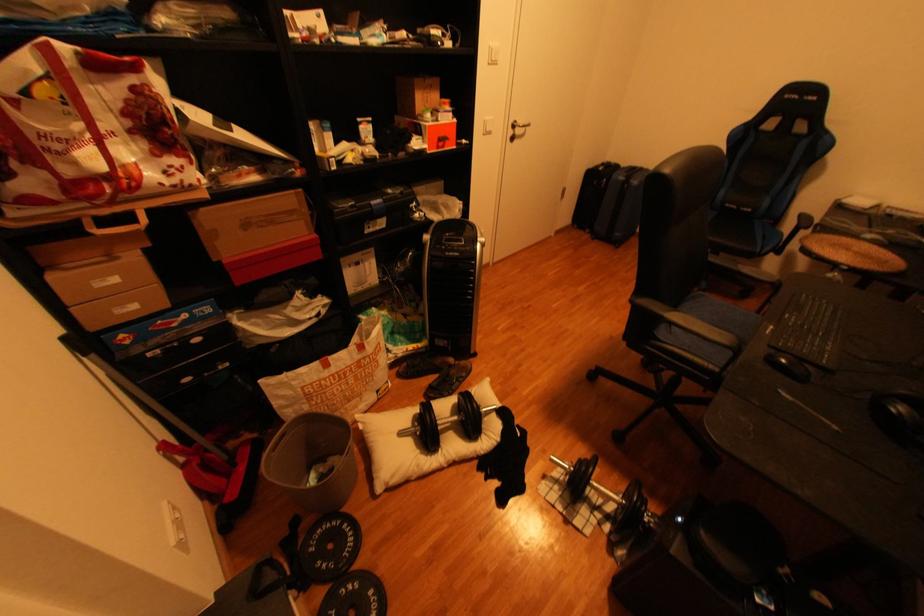
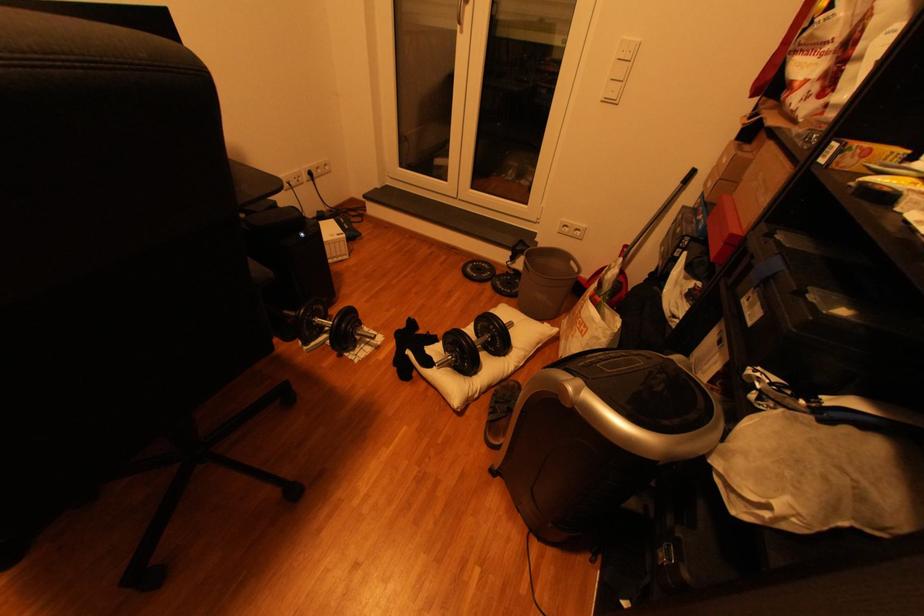
The point at (504, 416) is marked in the first image. Where is the corresponding point in the second image?

(445, 361)